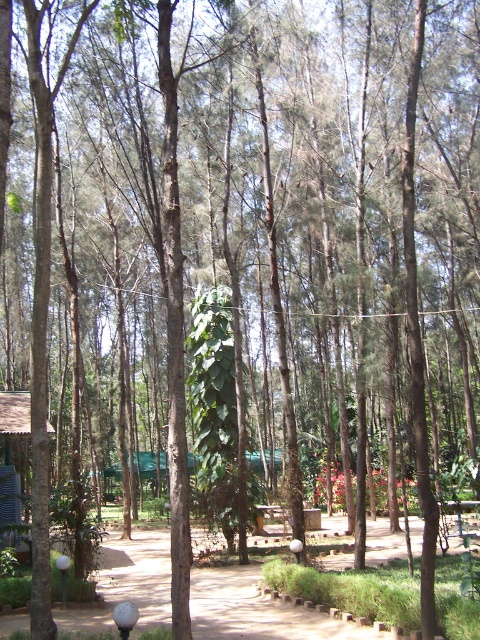
You are planning to build a small garden along the dirt path at center and the wooden hut at lower left. Which area has more space available for planting?

The dirt path at center has more space available for planting because it is bigger than the wooden hut at lower left.